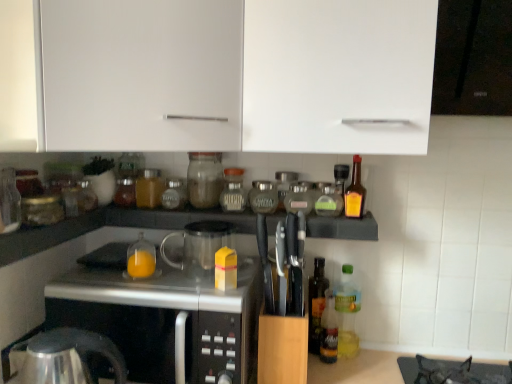
At what (x,y) coordinates should I click in order to perform the action: click on vacant space situated on the left part of translucent plastic carton at center, the second orange juice viewed from the back. Please return your answer as a coordinate pair (x, y). This screenshot has width=512, height=384. Looking at the image, I should click on (172, 283).